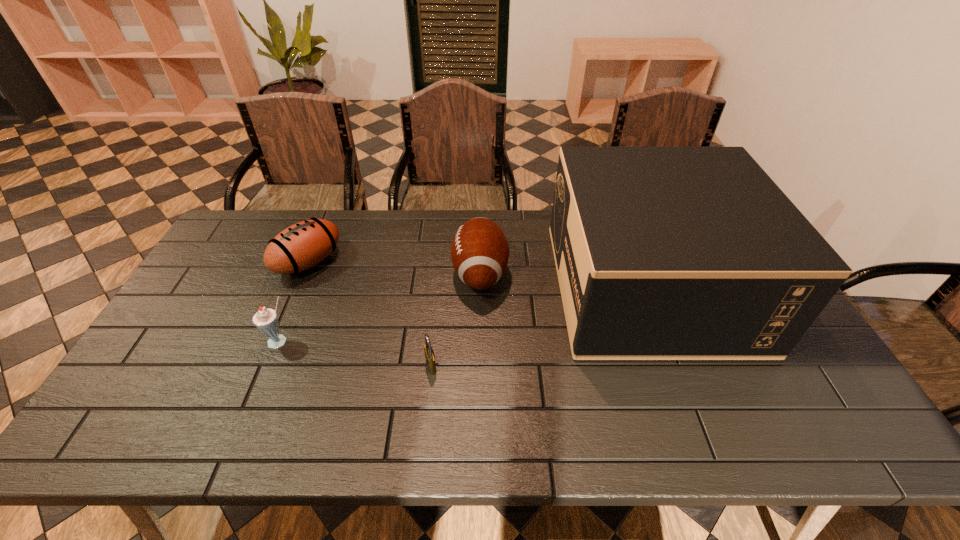
This screenshot has width=960, height=540. Identify the location of vacant area situated on the front-facing side of the box. (447, 286).

Find the location of a particular element. The width and height of the screenshot is (960, 540). vacant position located 0.330m on the front-facing side of the box is located at coordinates (451, 286).

Where is `vacant space situated on the laces of the taller football (American)`? vacant space situated on the laces of the taller football (American) is located at coordinates (385, 273).

This screenshot has height=540, width=960. I want to click on vacant space located 0.210m on the laces of the taller football (American), so click(385, 273).

Where is `vacant point located on the laces of the taller football (American)`? The width and height of the screenshot is (960, 540). vacant point located on the laces of the taller football (American) is located at coordinates (404, 273).

At what (x,y) coordinates should I click in order to perform the action: click on free space located 0.210m on the straw side of the milkshake. Please return your answer as a coordinate pair (x, y). Image resolution: width=960 pixels, height=540 pixels. Looking at the image, I should click on (248, 424).

Image resolution: width=960 pixels, height=540 pixels. I want to click on free space located 0.110m on the right of the left football (American), so click(373, 262).

You are a GUI agent. You are given a task and a screenshot of the screen. Output one action in this format:
    pyautogui.click(x=<x>, y=<y>)
    Task: Click on the free point located on the back of the third object from left to right
    
    Given the screenshot: What is the action you would take?
    pyautogui.click(x=434, y=339)

The height and width of the screenshot is (540, 960). Find the location of `box located in the far edge section of the desktop`. box located in the far edge section of the desktop is located at coordinates (662, 253).

Where is `object that is at the right edge`? The width and height of the screenshot is (960, 540). object that is at the right edge is located at coordinates (662, 253).